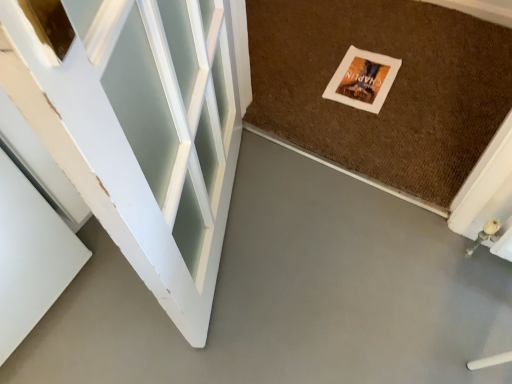
Question: Based on their sizes in the image, would you say brown textured mat at center is bigger or smaller than matte paper postcard at center?

Choices:
 (A) big
 (B) small

Answer: (A)

Question: From the image's perspective, is brown textured mat at center located above or below matte paper postcard at center?

Choices:
 (A) above
 (B) below

Answer: (A)

Question: Which object is positioned farthest from the matte paper postcard at center?

Choices:
 (A) gray smooth concrete at center
 (B) brown textured mat at center

Answer: (A)

Question: Which object is the closest to the gray smooth concrete at center?

Choices:
 (A) matte paper postcard at center
 (B) brown textured mat at center

Answer: (B)